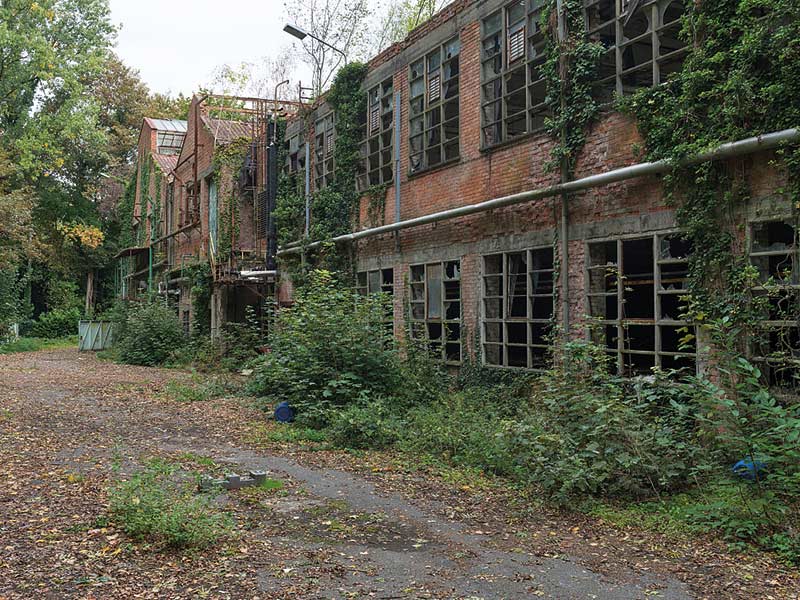
Find the location of `skylight`. skylight is located at coordinates (170, 130).